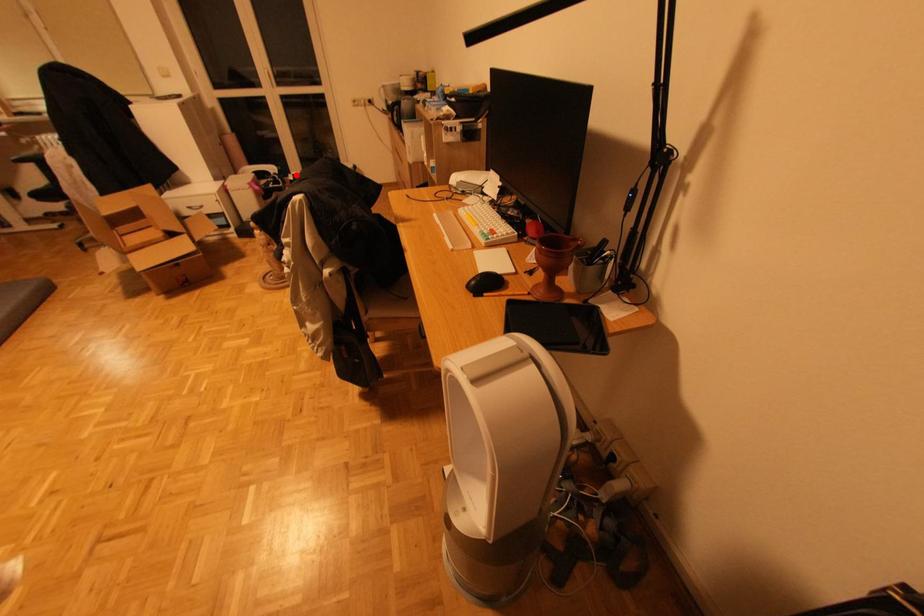
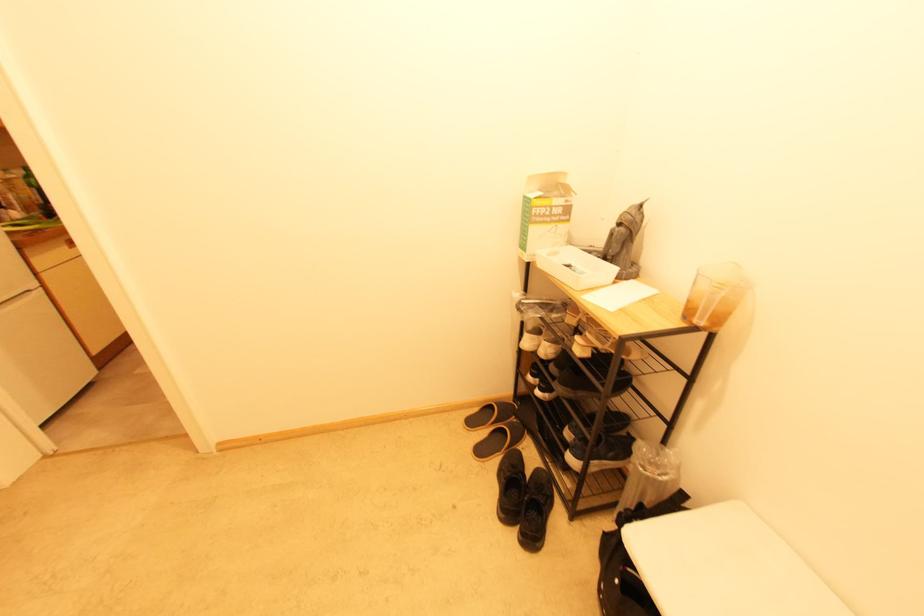
Question: I am providing you with two images of the same scene from different viewpoints. A red point is marked on the first image. Can you still see the location of the red point in image 2?

Choices:
 (A) Yes
 (B) No

Answer: (B)